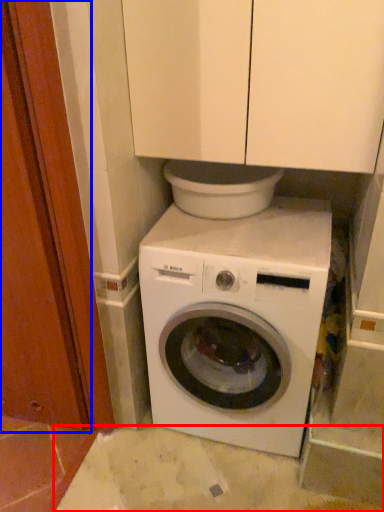
Question: Which point is further to the camera, concrete (highlighted by a red box) or screen door (highlighted by a blue box)?

Choices:
 (A) concrete
 (B) screen door

Answer: (A)